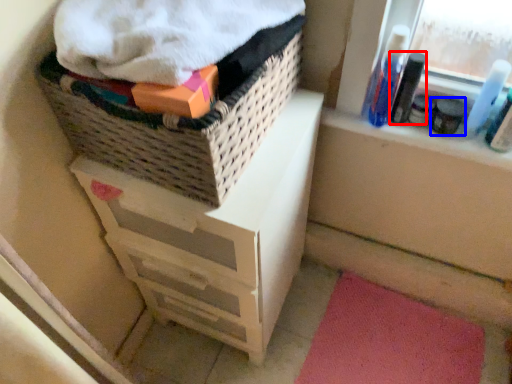
Question: Among these objects, which one is nearest to the camera, mouthwash (highlighted by a red box) or toiletry (highlighted by a blue box)?

Choices:
 (A) mouthwash
 (B) toiletry

Answer: (A)